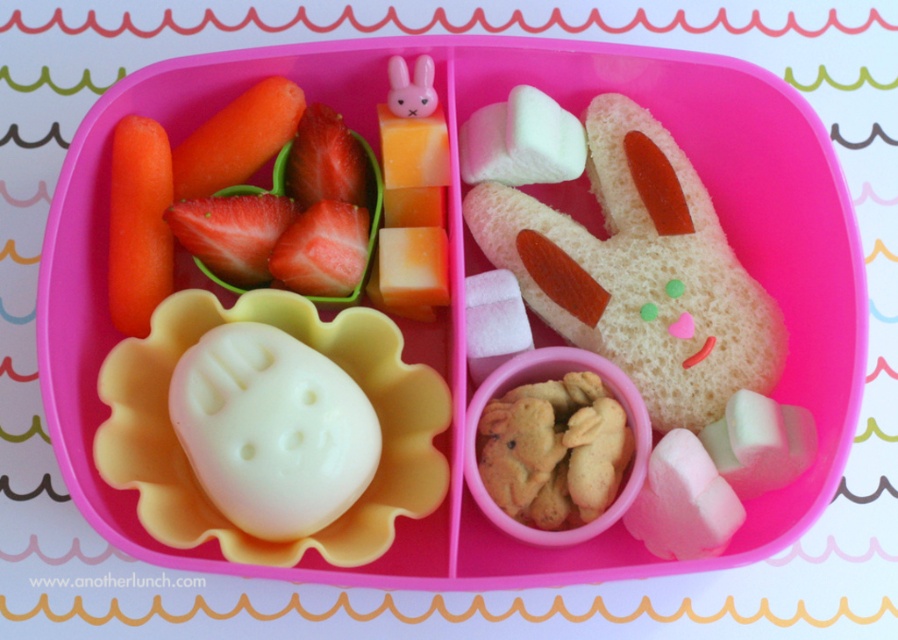
Who is taller, red smooth strawberries at upper left or orange smooth carrot at left?

orange smooth carrot at left

Is red smooth strawberries at upper left behind orange smooth carrot at left?

Yes, red smooth strawberries at upper left is behind orange smooth carrot at left.

Is point (359, 179) farther from camera compared to point (124, 246)?

That is True.

Identify the location of red smooth strawberries at upper left. The width and height of the screenshot is (898, 640). (289, 218).

Which is above, red smooth strawberries at upper left or orange smooth carrot at upper left?

orange smooth carrot at upper left

Describe the element at coordinates (289, 218) in the screenshot. I see `red smooth strawberries at upper left` at that location.

Who is more forward, (353, 189) or (227, 144)?

Point (227, 144) is more forward.

Where is `red smooth strawberries at upper left`? red smooth strawberries at upper left is located at coordinates (289, 218).

Between point (148, 216) and point (285, 131), which one is positioned in front?

Point (148, 216) is in front.

Does orange smooth carrot at left have a lesser width compared to orange smooth carrot at upper left?

Indeed, orange smooth carrot at left has a lesser width compared to orange smooth carrot at upper left.

Identify the location of orange smooth carrot at left. The width and height of the screenshot is (898, 640). (138, 224).